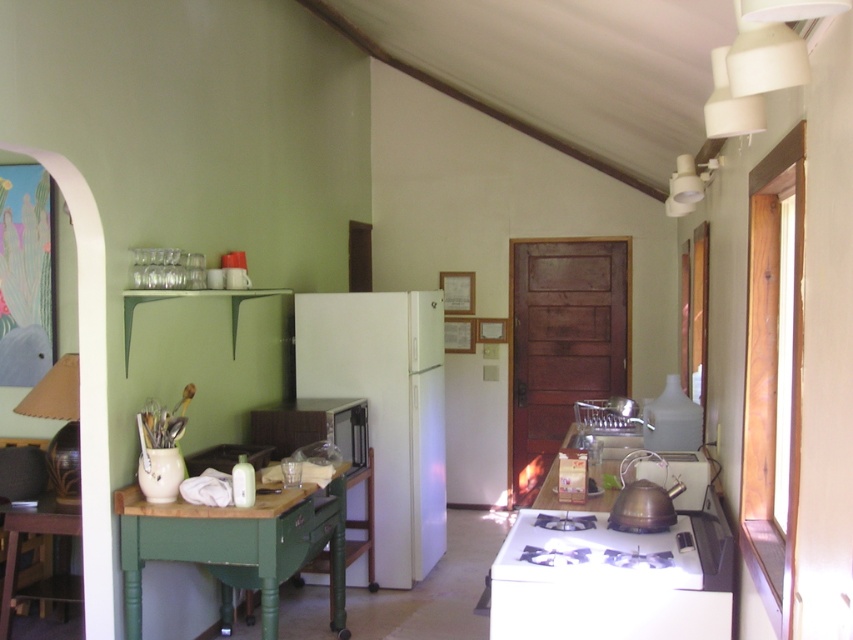
Who is more distant from viewer, [439,291] or [62,385]?

Point [439,291]

Where is `white matte refrigerator at center`? The image size is (853, 640). white matte refrigerator at center is located at coordinates (386, 410).

Where is `shiny brass kettle at center`? This screenshot has height=640, width=853. shiny brass kettle at center is located at coordinates (643, 499).

This screenshot has height=640, width=853. I want to click on shiny brass kettle at center, so click(x=643, y=499).

Is white matte refrigerator at center to the left of matte black microwave at center from the viewer's perspective?

No, white matte refrigerator at center is not to the left of matte black microwave at center.

Does point (395, 390) lie in front of point (248, 433)?

No, it is behind (248, 433).

Locate an element on the screen. Image resolution: width=853 pixels, height=640 pixels. white matte refrigerator at center is located at coordinates (386, 410).